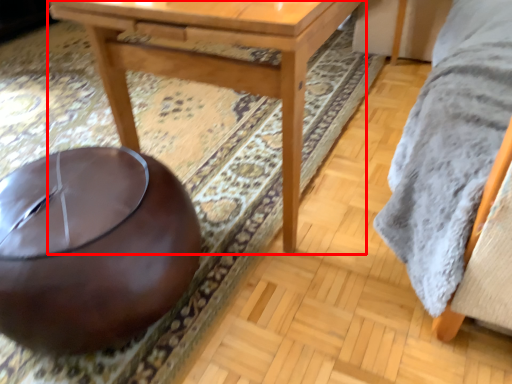
Question: From the image's perspective, what is the correct spatial relationship of table (annotated by the red box) in relation to bean bag chair?

Choices:
 (A) below
 (B) above

Answer: (B)